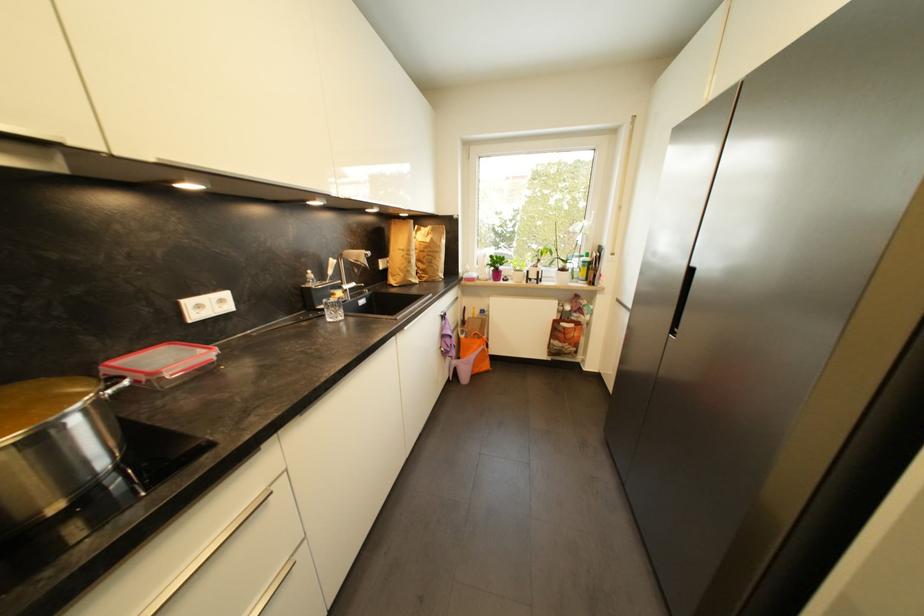
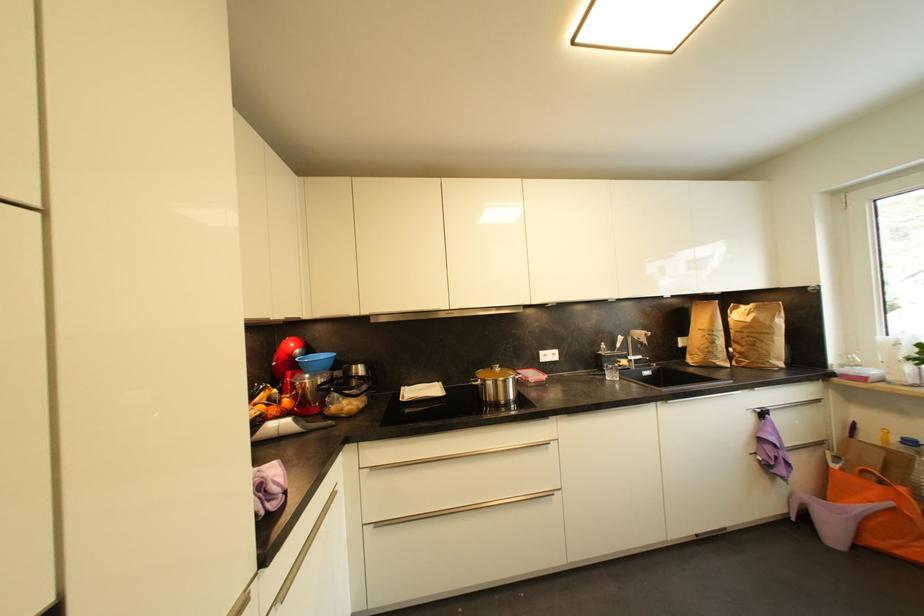
Where in the second image is the point corresponding to (x=339, y=317) from the first image?

(616, 378)